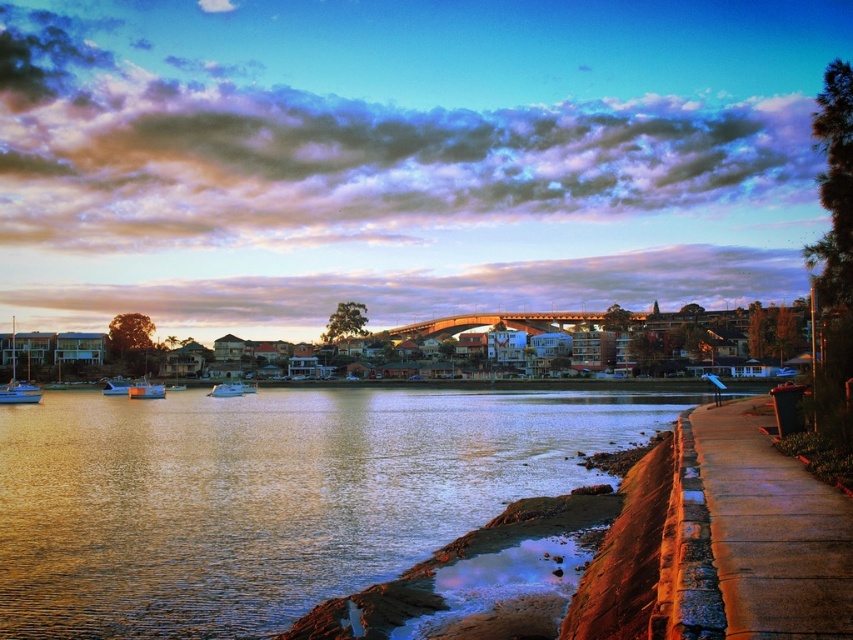
In the scene shown: You are a photographer positioned at the center of the riverbank. You want to capture the matte white sailboat at left in your shot. Based on its coordinates, is the boat located to your left or right side?

The matte white sailboat at left is positioned at coordinates point (15, 381). Since the boat is labeled as being at the left side, it would be to your left when standing at the center of the riverbank.

From the picture: You are standing at the riverside and want to locate two specific points in the scene. The first point is at coordinates point (x=804, y=531) and the second is at point (x=152, y=385). Which of these points is nearer to your current position?

Point (x=804, y=531) is closer to the viewer than point (x=152, y=385), so the first point is nearer to your current position.